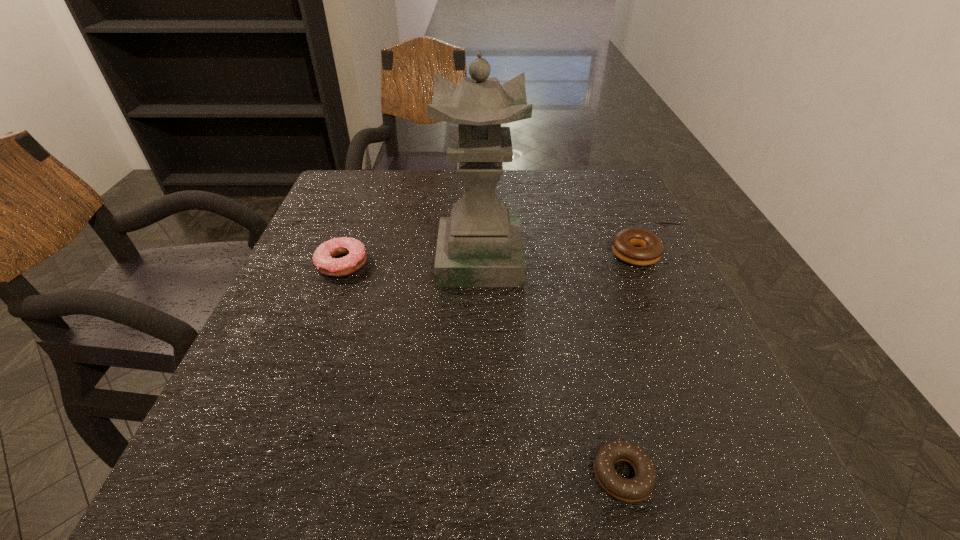
Locate an element on the screen. Image resolution: width=960 pixels, height=540 pixels. object situated at the near edge is located at coordinates (638, 488).

At what (x,y) coordinates should I click in order to perform the action: click on object at the left edge. Please return your answer as a coordinate pair (x, y). The width and height of the screenshot is (960, 540). Looking at the image, I should click on (323, 258).

The height and width of the screenshot is (540, 960). I want to click on object located at the right edge, so click(649, 249).

Find the location of `vacant space at the far edge of the desktop`. vacant space at the far edge of the desktop is located at coordinates (457, 191).

You are a GUI agent. You are given a task and a screenshot of the screen. Output one action in this format:
    pyautogui.click(x=<x>, y=<y>)
    Task: Click on the vacant region at the near edge of the desktop
    The height and width of the screenshot is (540, 960).
    Given the screenshot: What is the action you would take?
    pyautogui.click(x=507, y=477)

In the image, there is a desktop. Where is `blank space at the left edge`? blank space at the left edge is located at coordinates (267, 421).

In the image, there is a desktop. In order to click on free space at the right edge in this screenshot , I will do `click(610, 306)`.

The height and width of the screenshot is (540, 960). I want to click on vacant space at the far left corner of the desktop, so click(375, 208).

The width and height of the screenshot is (960, 540). In the image, there is a desktop. Identify the location of free space at the far right corner. (634, 208).

Where is `free space at the near right corner of the desktop`? This screenshot has width=960, height=540. free space at the near right corner of the desktop is located at coordinates (696, 498).